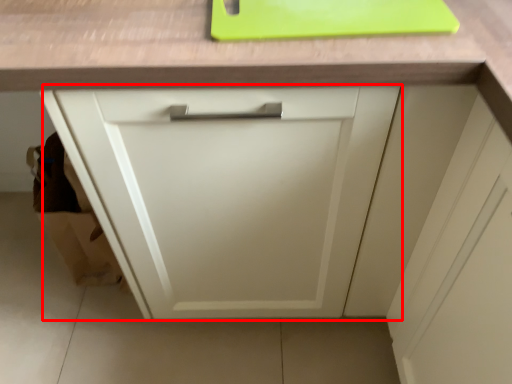
Question: In this image, where is cabinetry (annotated by the red box) located relative to cutting board?

Choices:
 (A) right
 (B) left

Answer: (B)